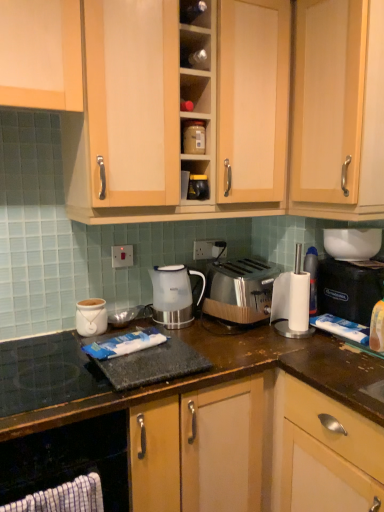
Find the location of `vacant region above wooden cabinet at lower center, the 1th cabinetry from the bottom (from a real-world perspective)`. vacant region above wooden cabinet at lower center, the 1th cabinetry from the bottom (from a real-world perspective) is located at coordinates (104, 338).